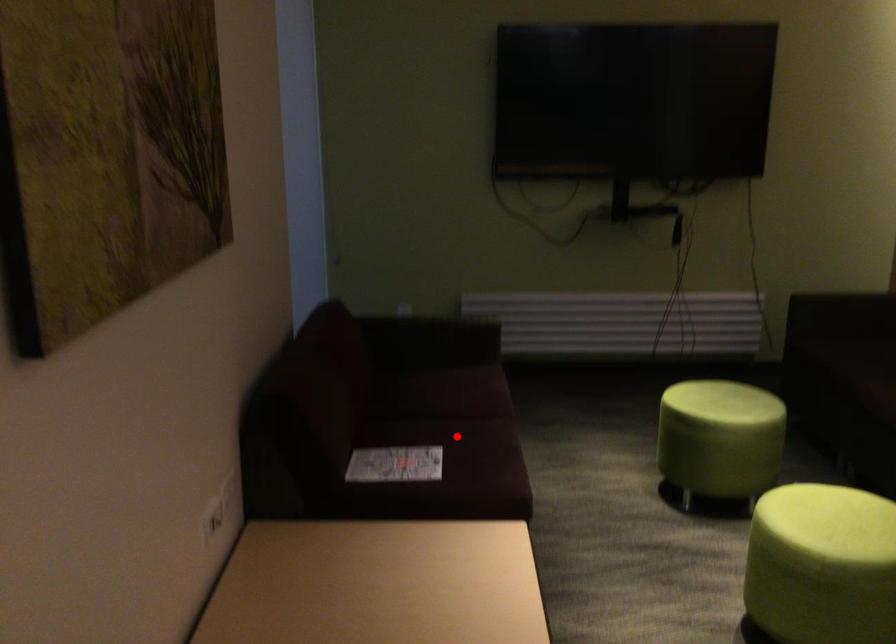
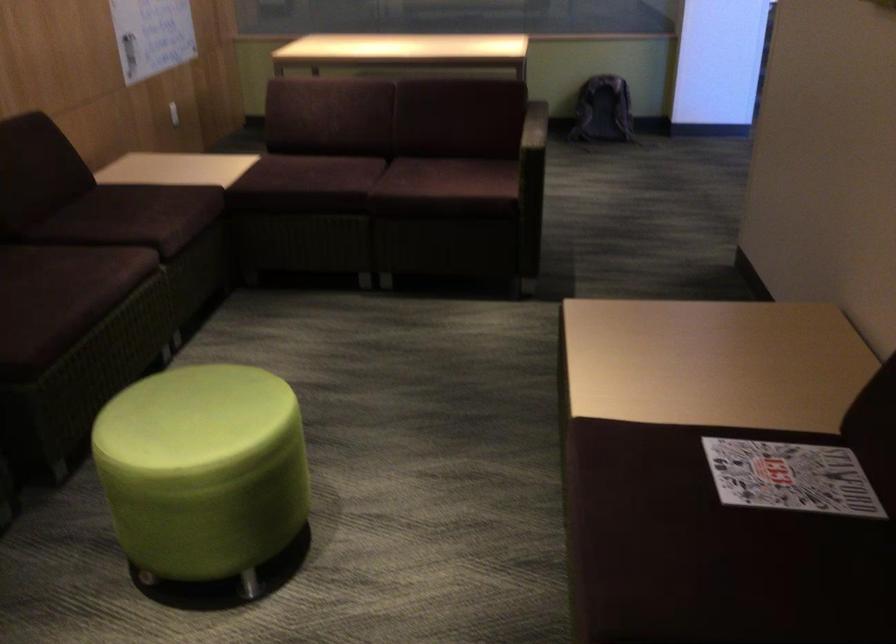
In the second image, find the point that corresponds to the highlighted location in the first image.

(712, 573)